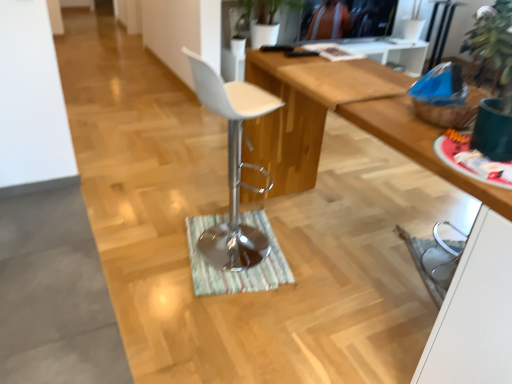
This screenshot has width=512, height=384. I want to click on empty space that is ontop of green striped mat at center, so click(x=237, y=260).